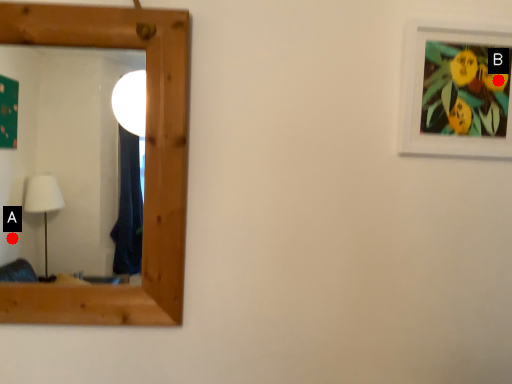
Question: Two points are circled on the image, labeled by A and B beside each circle. Which of the following is the closest to the observer?

Choices:
 (A) A is closer
 (B) B is closer

Answer: (B)